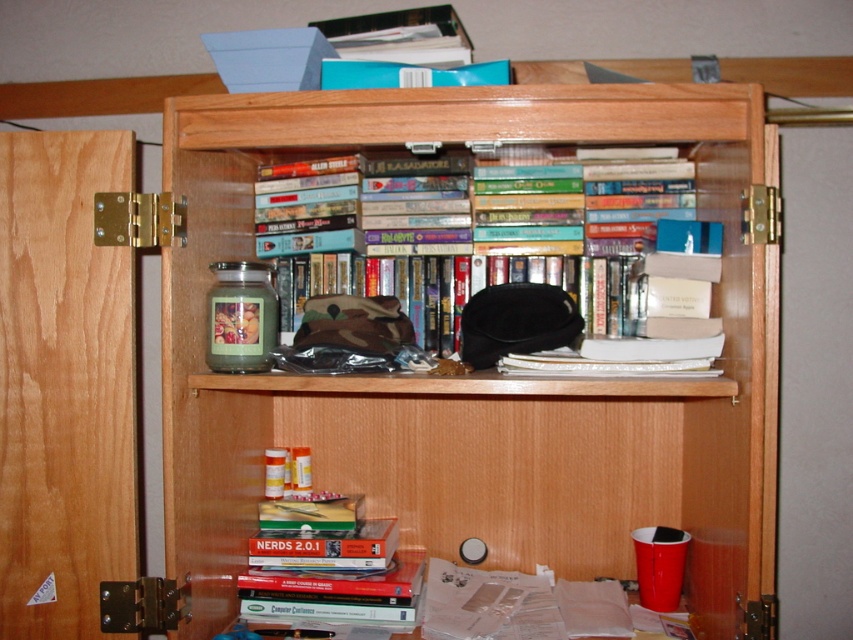
You are looking at the open wooden cabinet with two shelves. There are two points marked in the scene. The first point is at coordinate (619, 477) and the second at (303, 307). From your perspective, which point is closer to you?

Point (619, 477) is further to the camera than point (303, 307), so the second point is closer to you.

You are organizing items in the wooden bookshelf at upper center and want to place the hardcover books at upper center on top of it. Can you do this without the books falling off?

The wooden bookshelf at upper center is much taller than the hardcover books at upper center, so placing the books on top should be stable and they won t fall off.